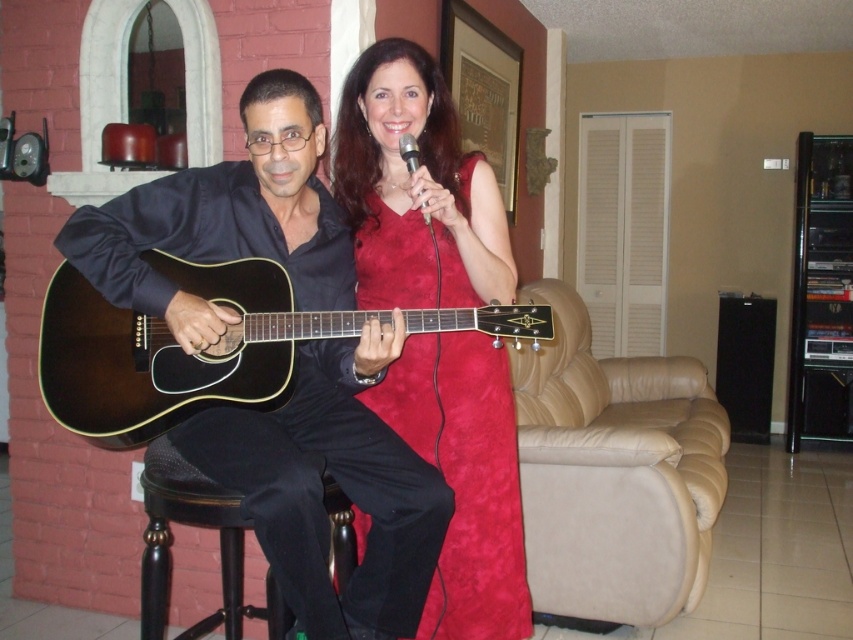
You are standing in the living room and want to reach the point marked at coordinates (498,440). If you take three steps forward, each step covering 0.7 meters, will you pass the point?

The distance to the point is 1.93 meters. Three steps of 0.7 meters each would cover 2.1 meters. Since 2.1 meters is greater than 1.93 meters, you would pass the point.

You are a photographer setting up a shoot in the living room. You need to place a small tripod between the matte black acoustic guitar at left and the black wood bar stool at lower left. Since the guitar is above the stool, will the tripod fit between them horizontally?

The matte black acoustic guitar at left is above the black wood bar stool at lower left, so placing a tripod between them horizontally should be possible as they are positioned at different vertical levels.

You are standing in the living room and want to place a small plant pot exactly at the point labeled as point (463, 477). Can you confirm if this location is near the velvet red dress at center?

Yes, the point (463, 477) corresponds to the velvet red dress at center, so placing the plant pot there would position it near the dress.